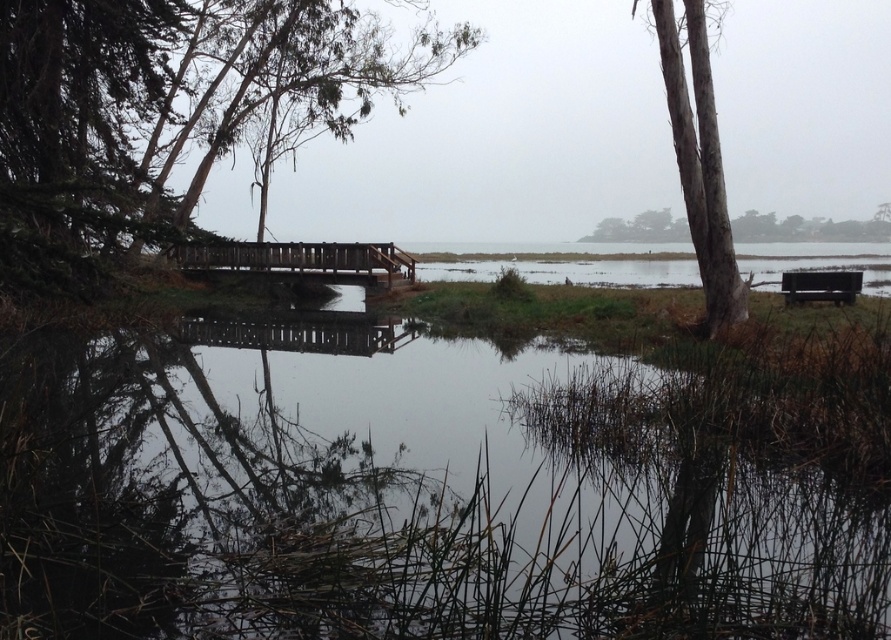
How far apart are smooth bark tree at upper right and dark brown wooden bench at right?

smooth bark tree at upper right is 31.76 meters away from dark brown wooden bench at right.

Can you confirm if smooth bark tree at upper right is taller than dark brown wooden bench at right?

Yes, smooth bark tree at upper right is taller than dark brown wooden bench at right.

Does point (777, 225) lie behind point (845, 292)?

That is True.

The width and height of the screenshot is (891, 640). Identify the location of smooth bark tree at upper right. (806, 228).

Is wooden bridge at center above smooth bark tree at upper right?

Actually, wooden bridge at center is below smooth bark tree at upper right.

Is wooden bridge at center thinner than smooth bark tree at upper right?

Yes.

The height and width of the screenshot is (640, 891). I want to click on wooden bridge at center, so click(298, 259).

Which is below, wooden bridge at center or dark brown wooden bench at right?

Positioned lower is dark brown wooden bench at right.

Is point (407, 275) positioned behind point (852, 275)?

Yes, it is.

Find the location of a particular element. The image size is (891, 640). wooden bridge at center is located at coordinates (298, 259).